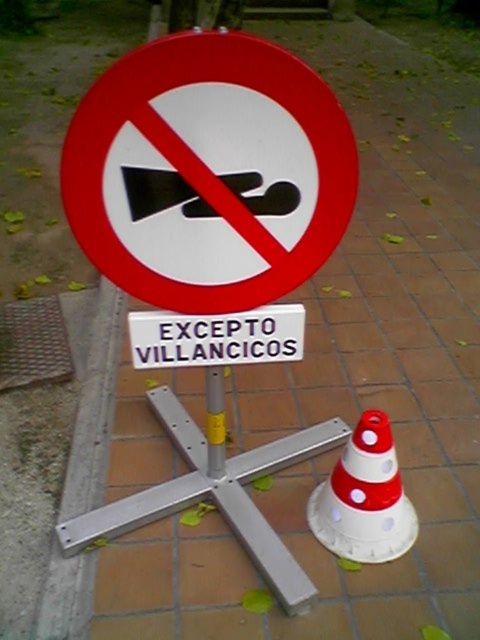
You are a delivery driver who needs to park your vehicle near the traffic sign. There is a white plastic traffic cone at center and a white plastic sign at center. Which object should you avoid placing your vehicle near to comply with parking regulations?

You should avoid placing your vehicle near the white plastic traffic cone at center because it is larger in size than the white plastic sign at center, indicating it marks a restricted area for parking.